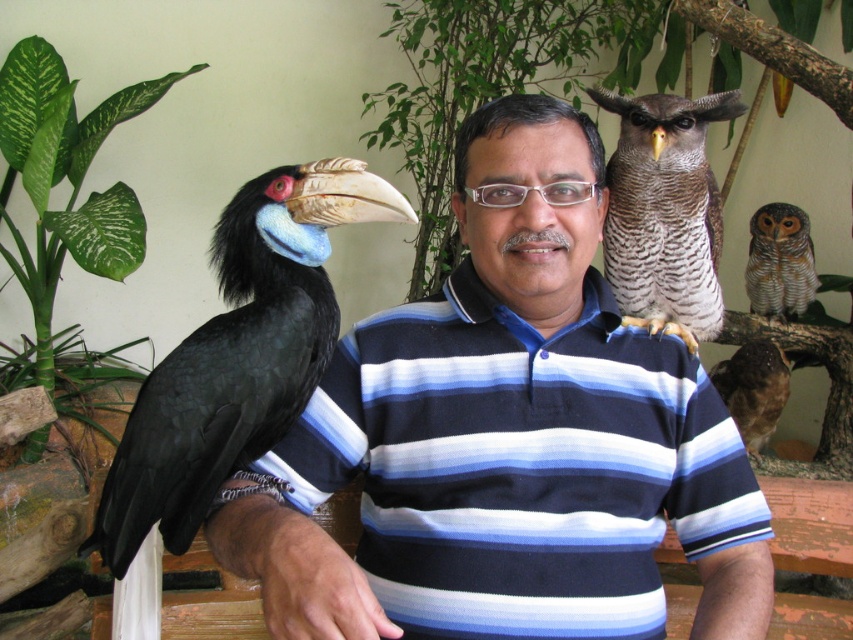
You are a photographer aiming to capture a clear photo of the speckled brown owl at upper right and the striped feathered owl at upper right. Which owl will appear closer to the camera in the photo?

The speckled brown owl at upper right is in front of the striped feathered owl at upper right, so it will appear closer to the camera in the photo.

You are a photographer trying to capture the man in the scene. The blue striped shirt at upper center and the black glossy hornbill at left are both in your frame. Which object is wider in the image?

The blue striped shirt at upper center is wider than the black glossy hornbill at left.

In the scene shown: You are a photographer trying to capture both the speckled brown owl at upper right and the striped feathered owl at upper right in a single frame. Which owl should you adjust your camera angle to focus on first to ensure both are in the shot?

The speckled brown owl at upper right is positioned under the striped feathered owl at upper right, so you should focus on the striped feathered owl at upper right first to ensure both are visible in the frame.